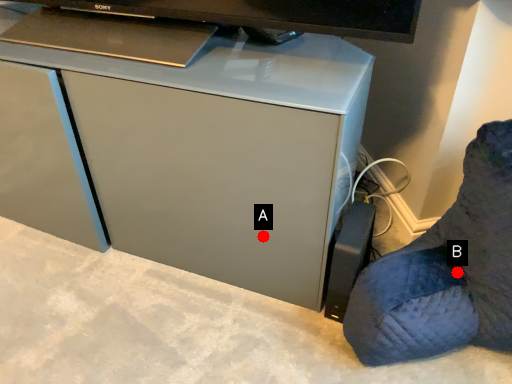
Question: Two points are circled on the image, labeled by A and B beside each circle. Which point is closer to the camera taking this photo?

Choices:
 (A) A is closer
 (B) B is closer

Answer: (B)